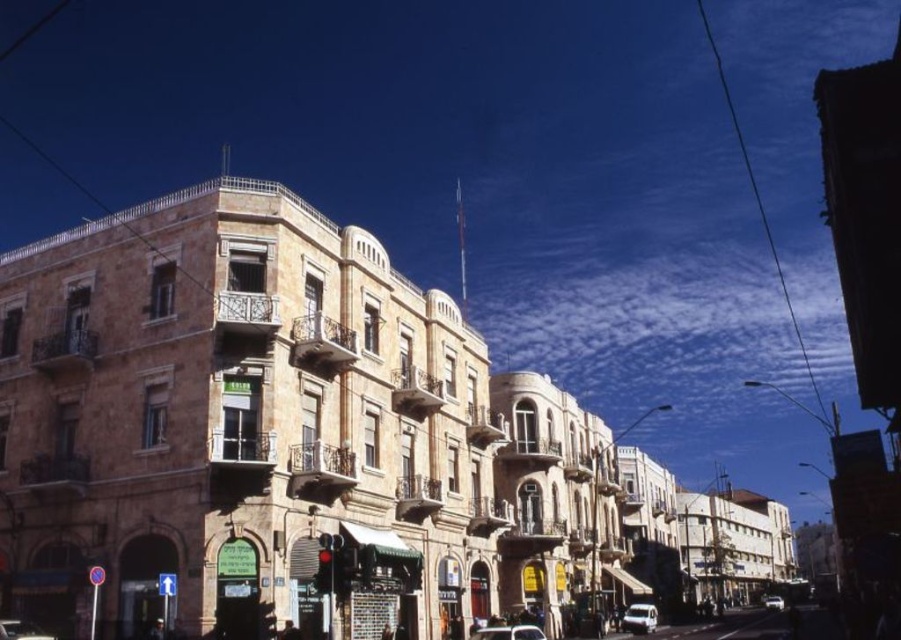
Is metallic silver car at center to the right of shiny silver car at lower left from the viewer's perspective?

Correct, you'll find metallic silver car at center to the right of shiny silver car at lower left.

You are a GUI agent. You are given a task and a screenshot of the screen. Output one action in this format:
    pyautogui.click(x=<x>, y=<y>)
    Task: Click on the metallic silver car at center
    Image resolution: width=901 pixels, height=640 pixels.
    Given the screenshot: What is the action you would take?
    pyautogui.click(x=508, y=632)

Is point (626, 609) closer to camera compared to point (478, 636)?

No, it is not.

Is white matte van at lower right positioned behind metallic silver car at center?

Yes, it is.

This screenshot has height=640, width=901. I want to click on white matte van at lower right, so click(639, 618).

Between white matte van at lower right and white glossy car at center, which one appears on the left side from the viewer's perspective?

white matte van at lower right is more to the left.

Is point (656, 620) farther from viewer compared to point (781, 604)?

No, it is not.

You are a GUI agent. You are given a task and a screenshot of the screen. Output one action in this format:
    pyautogui.click(x=<x>, y=<y>)
    Task: Click on the white matte van at lower right
    The height and width of the screenshot is (640, 901).
    Given the screenshot: What is the action you would take?
    coord(639,618)

This screenshot has width=901, height=640. In order to click on white matte van at lower right in this screenshot , I will do `click(639, 618)`.